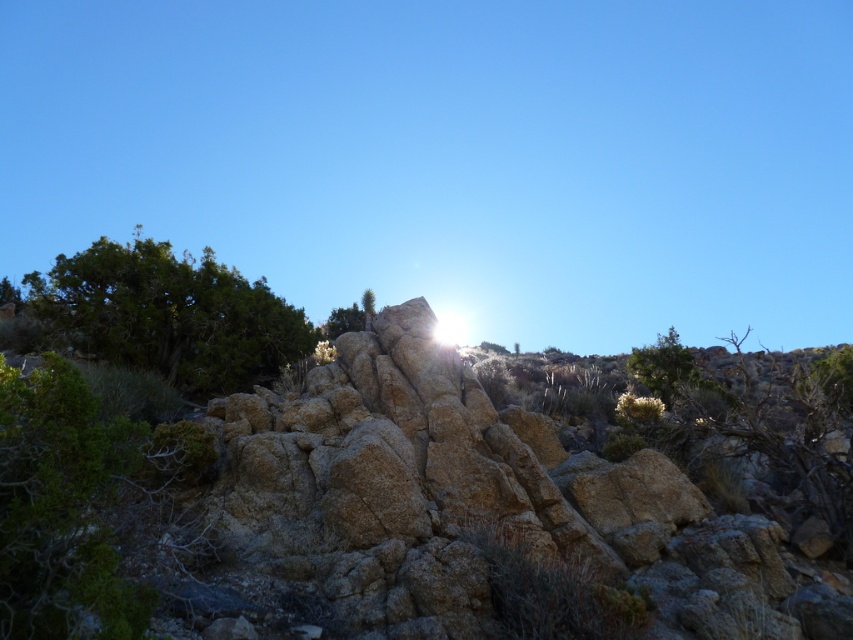
Based on the photo, you are a hiker who wants to take a photo of both the green leafy tree at upper left and the green leafy tree at upper right in the same frame. Considering their sizes, which tree should you position closer to the camera to ensure both are visible in the photo?

To include both the green leafy tree at upper left and the green leafy tree at upper right in the same frame, position the smaller green leafy tree at upper right closer to the camera since it is smaller than the one at upper left. This way, both trees will appear proportionally sized in your photo.

Looking at this image, you are standing in the middle of the rocky area and see the green leafy tree at upper left and the green leafy tree at upper right. Which tree is located to the left of the other?

The green leafy tree at upper left is positioned on the left side of the green leafy tree at upper right.

You are standing in the rugged landscape and want to reach the point marked as point (669, 408). There is an obstacle at point (120, 292). If you move directly towards your destination, will you encounter the obstacle first?

Yes, you will encounter the obstacle at point (120, 292) first because it is closer to you than the destination point (669, 408).